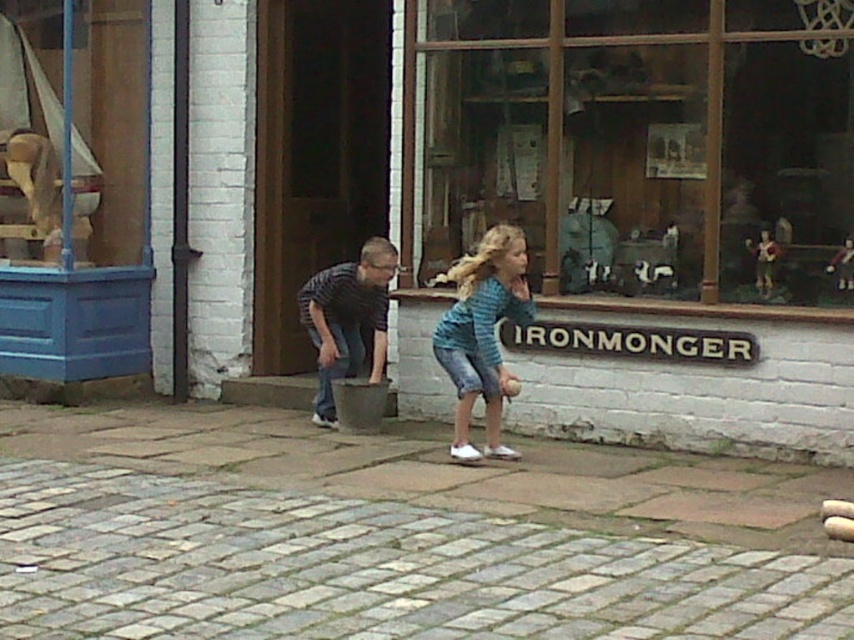
A child is holding a toy that is 12 centimeters long. They want to place it on the ground between the blue striped shirt at center and the brushed metal bucket at center. Is there enough space for the toy to fit entirely between them?

The distance between the blue striped shirt at center and the brushed metal bucket at center is 98.67 centimeters. Since the toy is only 12 centimeters long, there is ample space for it to fit entirely between them.

You are a delivery person who needs to place a heavy box on the ground. The gray stone pavement at lower center and the blue striped shirt at center are both visible. Which surface should you choose to place the box?

The gray stone pavement at lower center is positioned under the blue striped shirt at center, so the box should be placed on the gray stone pavement at lower center because it is a stable surface beneath the shirt.